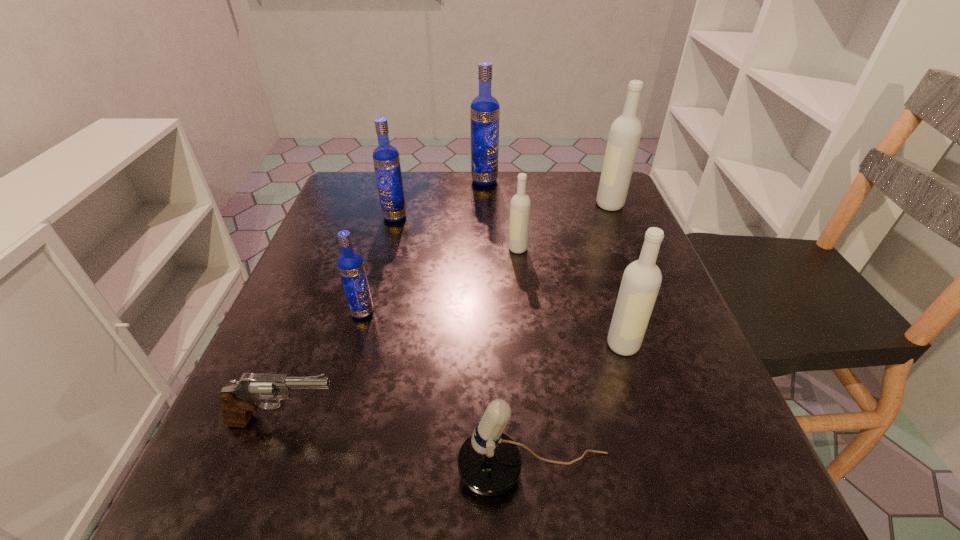
Where is `vacant space at the right edge of the desktop`? vacant space at the right edge of the desktop is located at coordinates click(636, 250).

The height and width of the screenshot is (540, 960). What are the coordinates of `free space at the far left corner of the desktop` in the screenshot? It's located at (369, 188).

I want to click on free region at the near left corner, so click(x=304, y=482).

In the image, there is a desktop. Where is `vacant region at the far right corner`? vacant region at the far right corner is located at coordinates [587, 176].

At what (x,y) coordinates should I click in order to perform the action: click on unoccupied area between the third nearest object and the fourth vodka from right to left. Please return your answer as a coordinate pair (x, y). This screenshot has width=960, height=540. Looking at the image, I should click on (553, 262).

Where is `free space between the seventh farthest object and the rightmost object`? This screenshot has height=540, width=960. free space between the seventh farthest object and the rightmost object is located at coordinates (447, 313).

The image size is (960, 540). I want to click on free spot between the biggest blue vodka and the pistol, so click(x=384, y=301).

Where is `free space between the biggest white vodka and the microphone`? The width and height of the screenshot is (960, 540). free space between the biggest white vodka and the microphone is located at coordinates (572, 338).

Locate an element on the screen. This screenshot has height=540, width=960. vacant space that is in between the second white vodka from right to left and the gray pistol is located at coordinates (453, 383).

Find the location of a particular element. The width and height of the screenshot is (960, 540). empty location between the second smallest blue vodka and the nearest vodka is located at coordinates (509, 281).